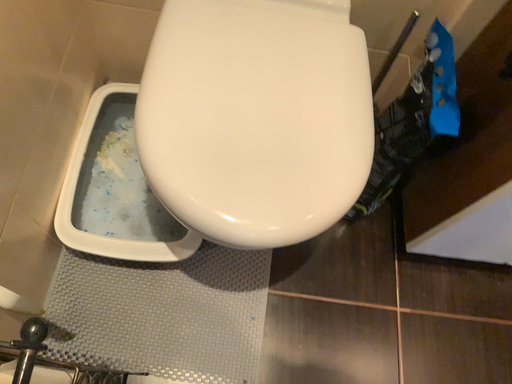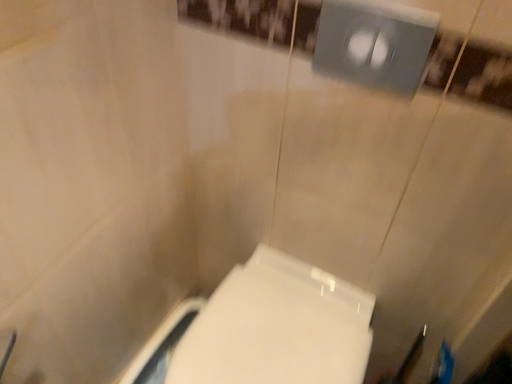
Question: How did the camera likely rotate when shooting the video?

Choices:
 (A) rotated left
 (B) rotated right

Answer: (A)